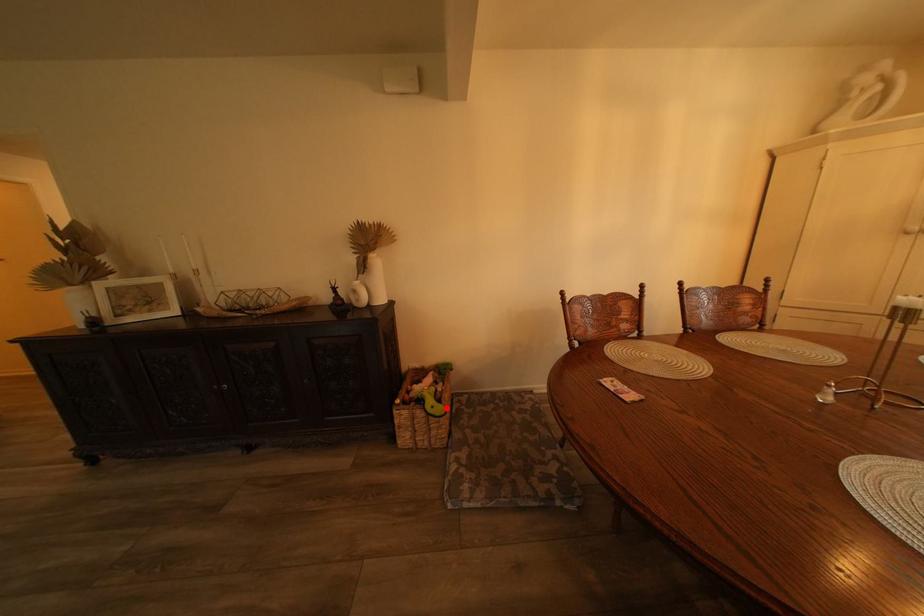
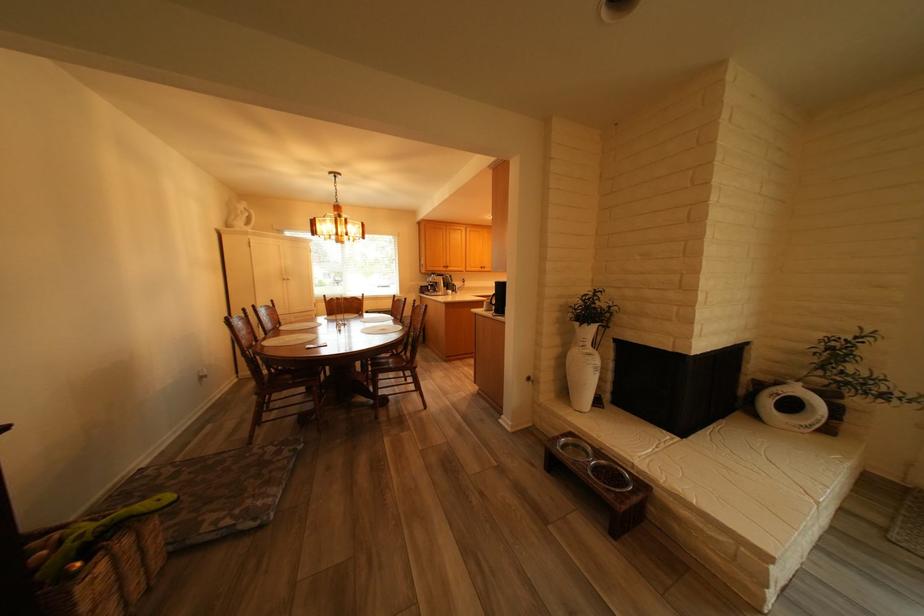
Question: I am providing you with two images of the same scene from different viewpoints. Image1 has a red point marked. In image2, the corresponding 3D location appears at what relative position? Reply with the corresponding letter.

Choices:
 (A) Closer
 (B) Farther

Answer: (B)